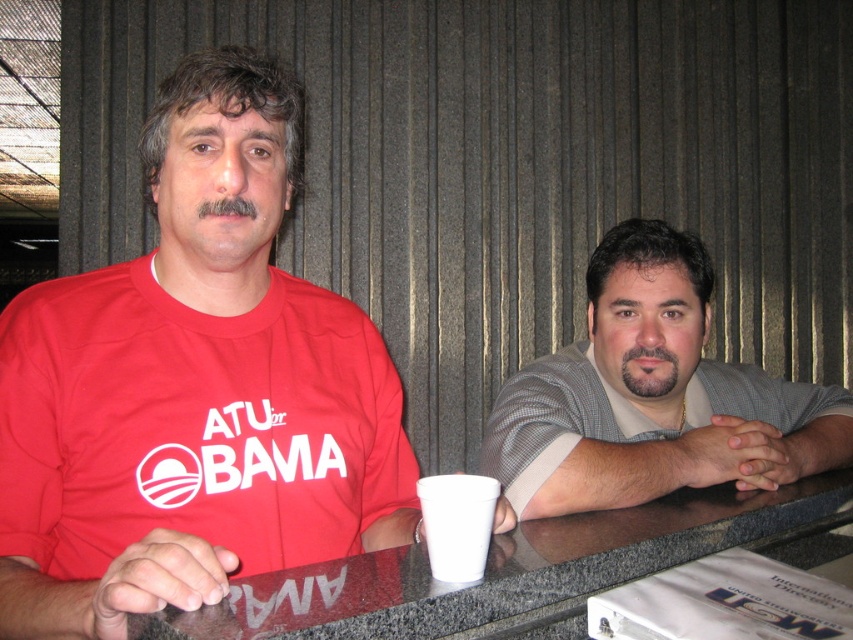
Which is behind, point (393, 628) or point (488, 496)?

Positioned behind is point (488, 496).

At what (x,y) coordinates should I click in order to perform the action: click on granite table at center. Please return your answer as a coordinate pair (x, y). Image resolution: width=853 pixels, height=640 pixels. Looking at the image, I should click on (508, 572).

Is the position of matte red t-shirt at left less distant than that of gray textured shirt at right?

That is True.

Can you confirm if matte red t-shirt at left is positioned above gray textured shirt at right?

Correct, matte red t-shirt at left is located above gray textured shirt at right.

Is point (187, 374) positioned after point (606, 316)?

No, it is not.

I want to click on matte red t-shirt at left, so click(x=193, y=387).

Can you confirm if gray textured shirt at right is positioned above granite table at center?

Yes.

Image resolution: width=853 pixels, height=640 pixels. Describe the element at coordinates (653, 396) in the screenshot. I see `gray textured shirt at right` at that location.

Is point (753, 435) behind point (419, 616)?

Yes, point (753, 435) is behind point (419, 616).

Image resolution: width=853 pixels, height=640 pixels. What are the coordinates of `gray textured shirt at right` in the screenshot? It's located at (653, 396).